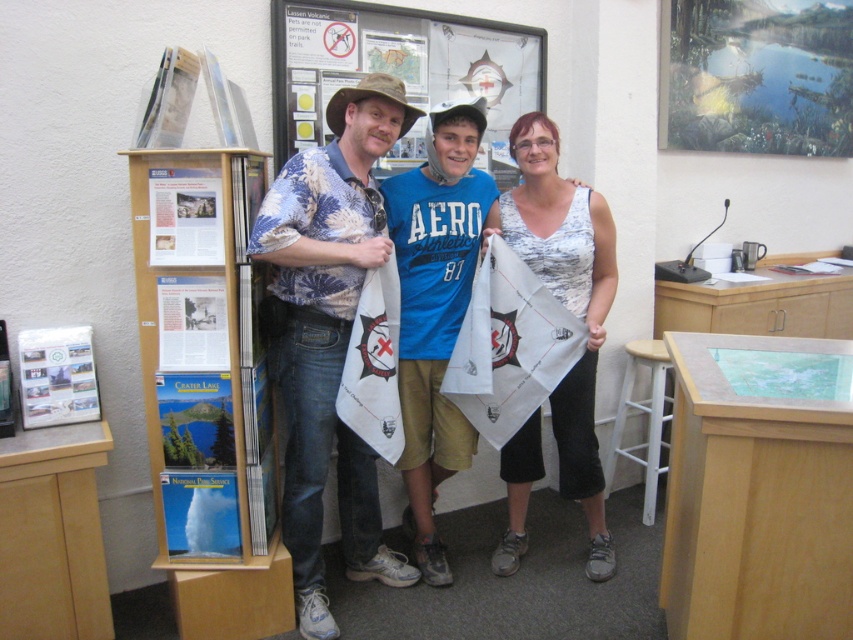
You are a visitor trying to read the white paper poster at center and the metallic reflective poster at upper right. Which poster is closer to the ground?

The white paper poster at center is positioned under the metallic reflective poster at upper right, so it is closer to the ground.